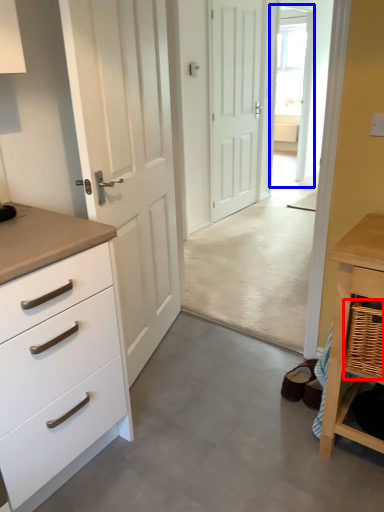
Question: Which of the following is the farthest to the observer, basket (highlighted by a red box) or glass door (highlighted by a blue box)?

Choices:
 (A) basket
 (B) glass door

Answer: (B)